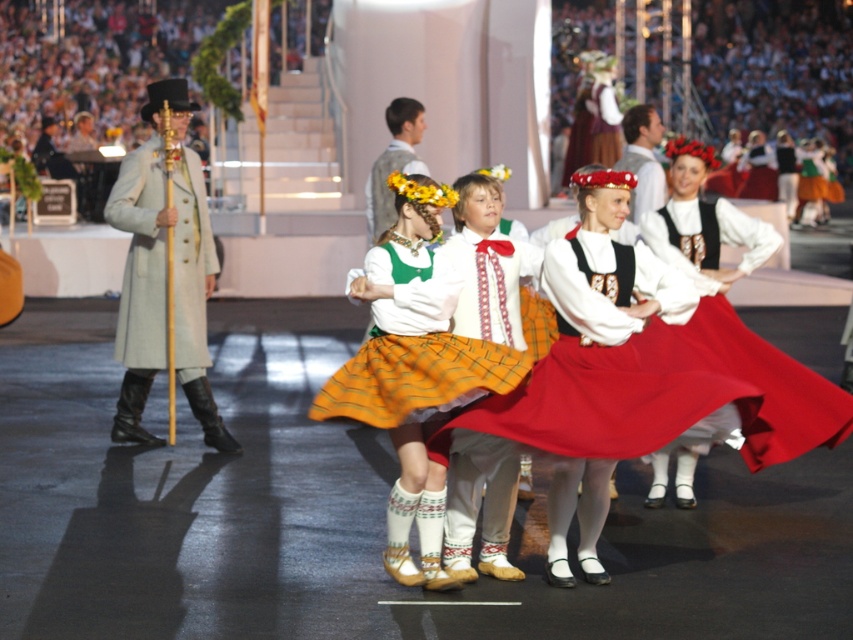
Based on the photo, is matte yellow skirt at center bigger than matte red skirt at center?

Yes, matte yellow skirt at center is bigger than matte red skirt at center.

Locate an element on the screen. matte yellow skirt at center is located at coordinates (415, 365).

Which of these two, light beige wool coat at left or matte red skirt at center, stands shorter?

matte red skirt at center

You are a GUI agent. You are given a task and a screenshot of the screen. Output one action in this format:
    pyautogui.click(x=<x>, y=<y>)
    Task: Click on the light beige wool coat at left
    This screenshot has width=853, height=640.
    Given the screenshot: What is the action you would take?
    pyautogui.click(x=141, y=259)

The width and height of the screenshot is (853, 640). Find the location of `light beige wool coat at left`. light beige wool coat at left is located at coordinates (141, 259).

Who is positioned more to the left, matte yellow skirt at center or light beige wool coat at left?

From the viewer's perspective, light beige wool coat at left appears more on the left side.

Between point (473, 346) and point (195, 316), which one is positioned in front?

Positioned in front is point (473, 346).

Who is more forward, (364, 340) or (120, 314)?

Point (364, 340)

I want to click on matte yellow skirt at center, so click(415, 365).